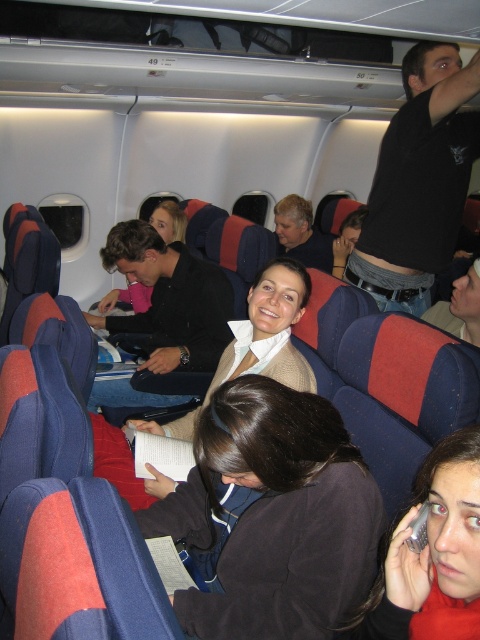
Is matte black hair at center to the right of matte beige sweater at center from the viewer's perspective?

Indeed, matte black hair at center is positioned on the right side of matte beige sweater at center.

I want to click on matte black hair at center, so click(432, 554).

Locate an element on the screen. The width and height of the screenshot is (480, 640). matte black hair at center is located at coordinates (432, 554).

Does matte black hair at center have a smaller size compared to matte black jacket at center?

Result: Yes.

Which of these two, matte black hair at center or matte black jacket at center, stands taller?

matte black jacket at center is taller.

Is point (476, 484) less distant than point (205, 275)?

That is True.

Locate an element on the screen. This screenshot has height=640, width=480. matte black hair at center is located at coordinates (432, 554).

Is black cotton shirt at upper center smaller than matte black hair at center?

Incorrect, black cotton shirt at upper center is not smaller in size than matte black hair at center.

Who is lower down, black cotton shirt at upper center or matte black hair at center?

Positioned lower is matte black hair at center.

I want to click on black cotton shirt at upper center, so click(419, 180).